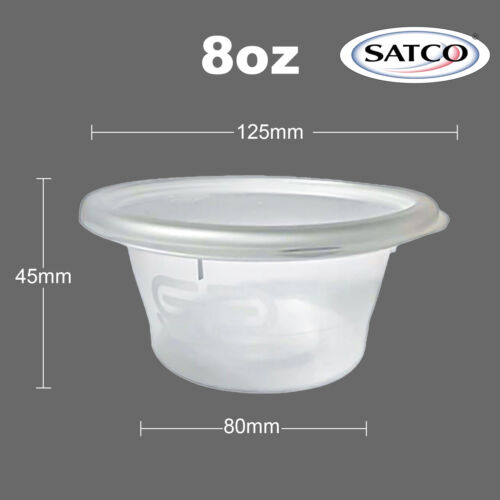
Locate an element on the screen. The image size is (500, 500). volume of tub is located at coordinates (230, 54).